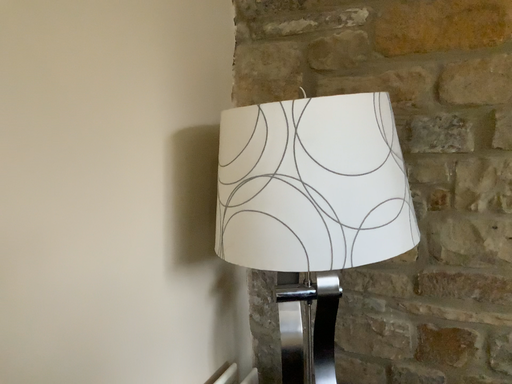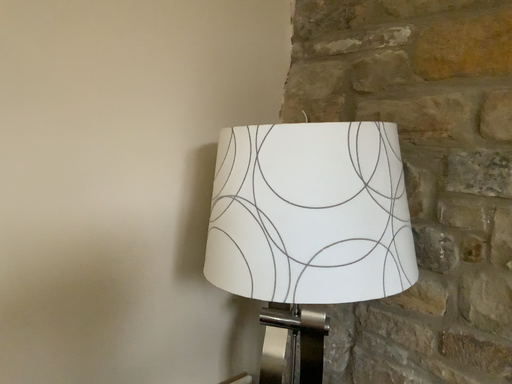
Question: How did the camera likely rotate when shooting the video?

Choices:
 (A) rotated right
 (B) rotated left

Answer: (B)